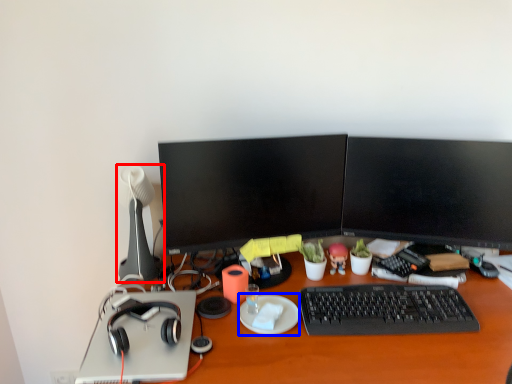
Question: Which of the following is the closest to the observer, lamp (highlighted by a red box) or plate (highlighted by a blue box)?

Choices:
 (A) lamp
 (B) plate

Answer: (B)